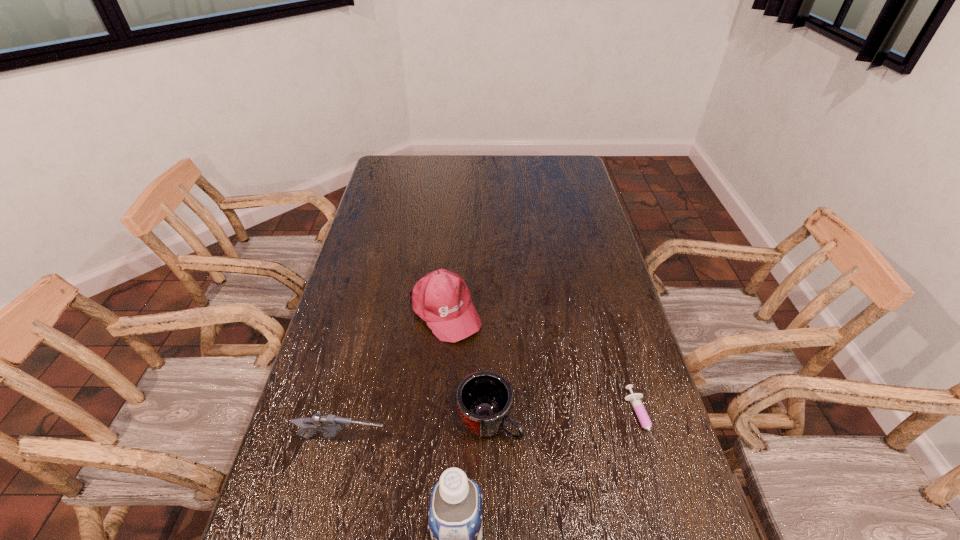
Identify the location of vacant space that satisfies the following two spatial constraints: 1. on the back side of the farthest object; 2. on the right side of the gun. (374, 313).